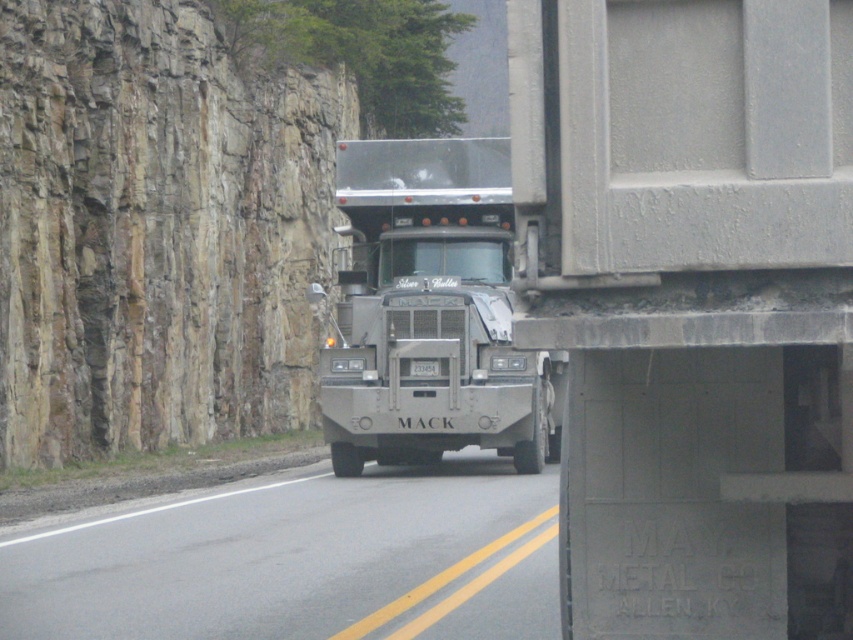
You are a delivery driver who needs to park the gray concrete trailer truck at right on the gray asphalt road at center. The parking space is only 10 meters long. Can the truck park there?

The gray concrete trailer truck at right is 11.00 meters away from the gray asphalt road at center, which is longer than the parking space. Therefore, the truck cannot park there.

From the picture: You are a pedestrian standing at point (802, 403). The truck is approaching you on the road. Is the truck closer to you than 20 feet?

The distance between point (802, 403) and the camera is 18.31 feet, so yes, the truck is closer than 20 feet.

You are a driver planning to make a U turn on the gray asphalt road at center. The U turn requires a minimum of 10 meters of clear road. Can you determine if there is enough space for the U turn based on the provided coordinates?

The gray asphalt road at center is located at point (299, 560). However, the length of the road segment at this coordinate is not provided, so it is impossible to determine if there is sufficient space for a 10 meter U turn.